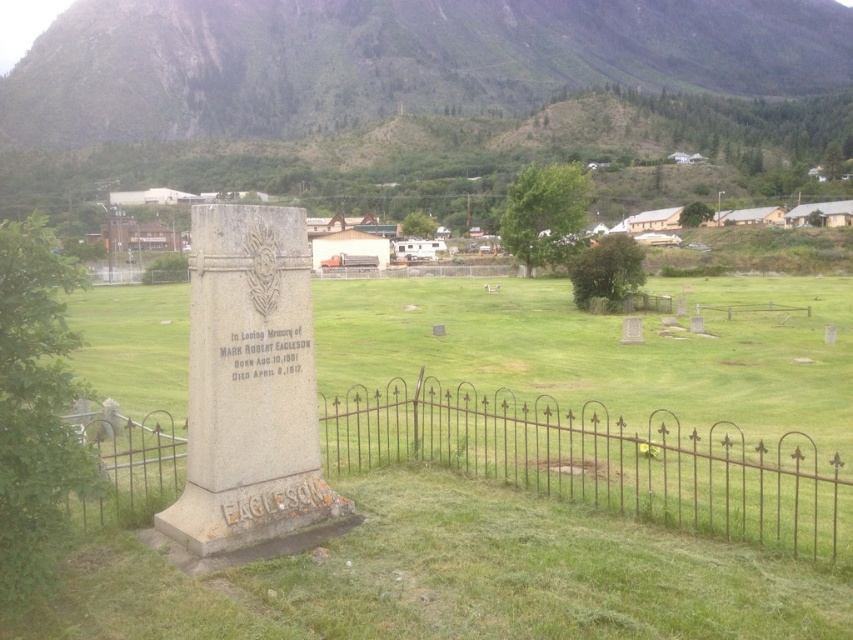
Can you confirm if green grassy at center is shorter than green grassy hill at upper center?

Yes.

This screenshot has width=853, height=640. What do you see at coordinates (454, 579) in the screenshot?
I see `green grassy at center` at bounding box center [454, 579].

This screenshot has height=640, width=853. In order to click on green grassy at center in this screenshot , I will do `click(454, 579)`.

Can you confirm if rusty metal fence at center is shorter than gray stone monument at center?

Yes.

Image resolution: width=853 pixels, height=640 pixels. What do you see at coordinates (602, 460) in the screenshot?
I see `rusty metal fence at center` at bounding box center [602, 460].

The image size is (853, 640). I want to click on rusty metal fence at center, so click(x=602, y=460).

This screenshot has height=640, width=853. What are the coordinates of `rusty metal fence at center` in the screenshot? It's located at (602, 460).

Describe the element at coordinates (454, 579) in the screenshot. I see `green grassy at center` at that location.

From the picture: Who is shorter, green grassy at center or gray stone monument at center?

With less height is gray stone monument at center.

You are a GUI agent. You are given a task and a screenshot of the screen. Output one action in this format:
    pyautogui.click(x=<x>, y=<y>)
    Task: Click on the green grassy at center
    This screenshot has width=853, height=640.
    Given the screenshot: What is the action you would take?
    pyautogui.click(x=454, y=579)

At what (x,y) coordinates should I click in order to perform the action: click on green grassy at center. Please return your answer as a coordinate pair (x, y). The width and height of the screenshot is (853, 640). Looking at the image, I should click on (454, 579).